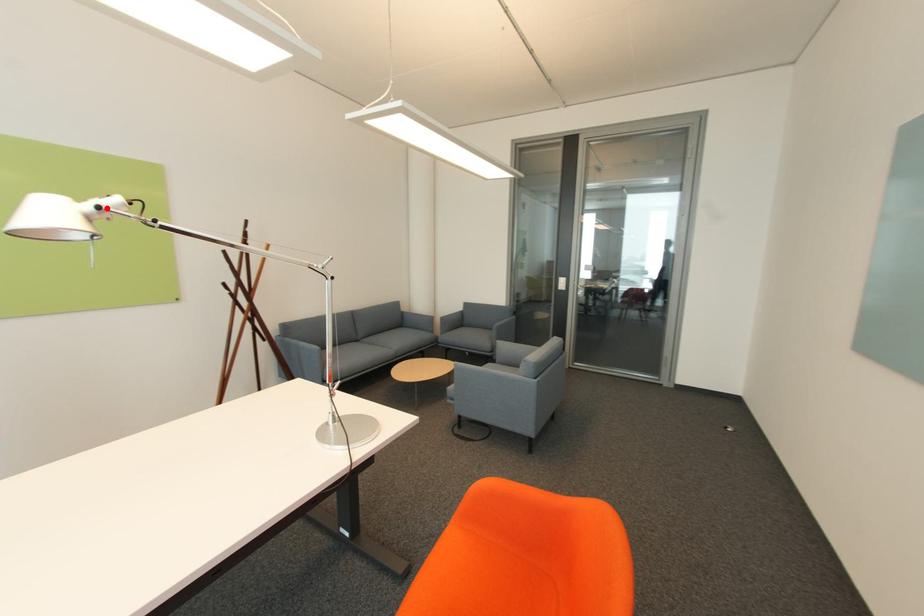
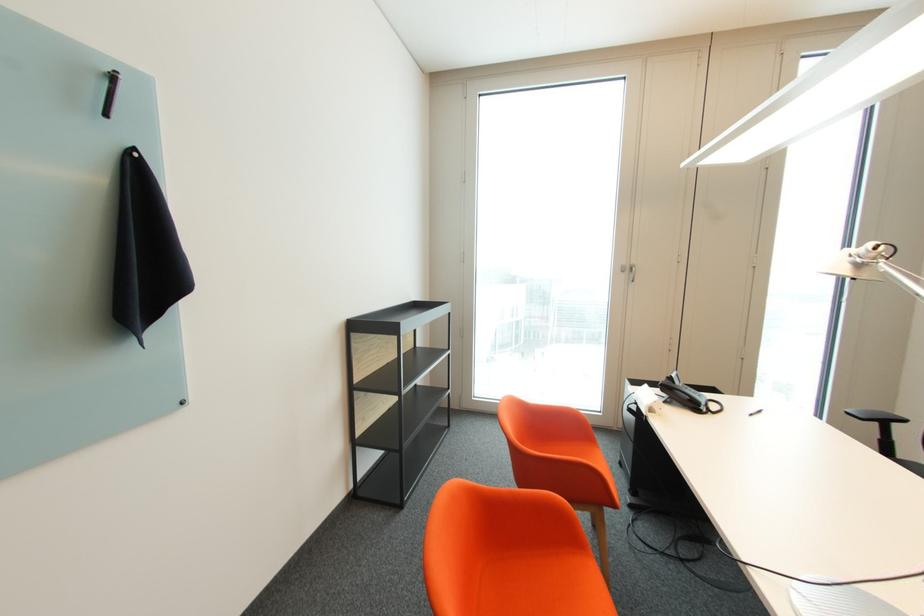
Find the pixel in the second image that matches the highlighted location in the first image.

(860, 256)